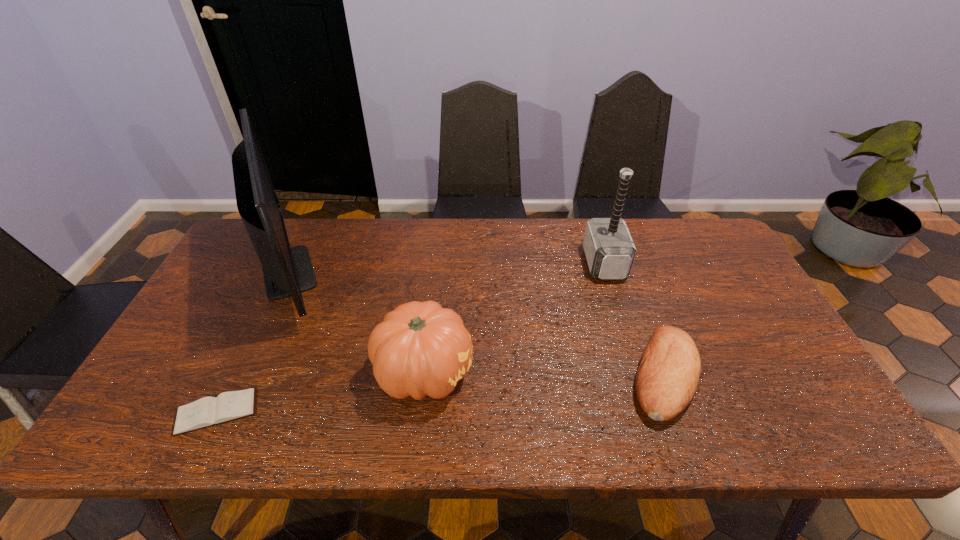
Image resolution: width=960 pixels, height=540 pixels. I want to click on vacant space located 0.120m on the carved face of the third shortest object, so click(x=522, y=372).

You are a GUI agent. You are given a task and a screenshot of the screen. Output one action in this format:
    pyautogui.click(x=<x>, y=<y>)
    Task: Click on the vacant point located 0.050m on the back of the bread
    This screenshot has width=960, height=540.
    Given the screenshot: What is the action you would take?
    pyautogui.click(x=643, y=319)

You are a GUI agent. You are given a task and a screenshot of the screen. Output one action in this format:
    pyautogui.click(x=<x>, y=<y>)
    Task: Click on the free region located on the back of the diary
    The height and width of the screenshot is (540, 960).
    Given the screenshot: What is the action you would take?
    pyautogui.click(x=254, y=334)

Locate an element on the screen. computer monitor at the far edge is located at coordinates (288, 271).

Find the location of a particular element. This screenshot has width=960, height=540. hammer that is positioned at the far edge is located at coordinates (610, 251).

You are a GUI agent. You are given a task and a screenshot of the screen. Output one action in this format:
    pyautogui.click(x=<x>, y=<y>)
    Task: Click on the pumpkin at the near edge
    This screenshot has height=540, width=960.
    Given the screenshot: What is the action you would take?
    pyautogui.click(x=420, y=348)

Locate an element on the screen. This screenshot has height=540, width=960. bread at the near edge is located at coordinates (669, 369).

Find the location of `diary that is at the near edge`. diary that is at the near edge is located at coordinates (208, 411).

At what (x,y) coordinates should I click in order to perform the action: click on computer monitor that is at the left edge. Please return your answer as a coordinate pair (x, y). Image resolution: width=960 pixels, height=540 pixels. Looking at the image, I should click on (288, 271).

Locate an element on the screen. diary that is at the left edge is located at coordinates (208, 411).